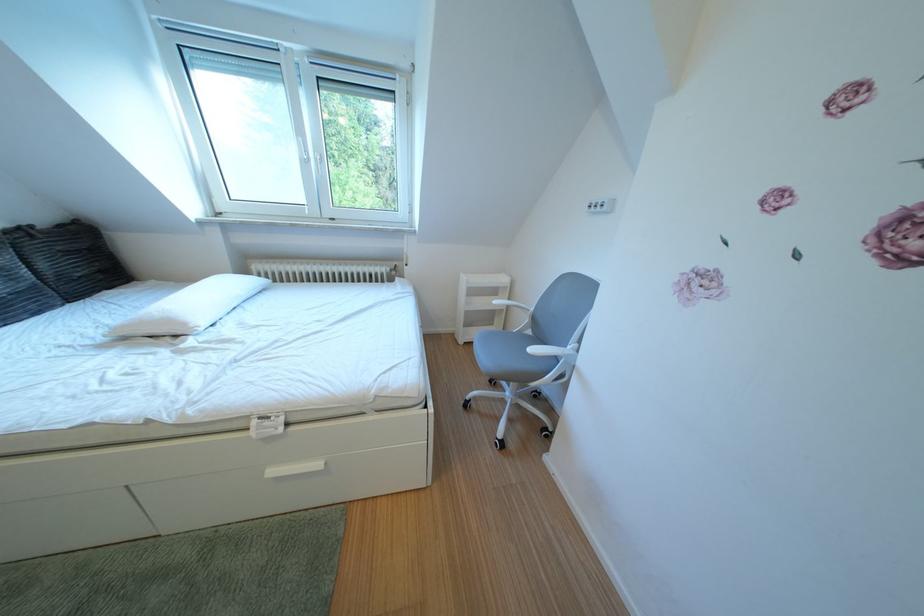
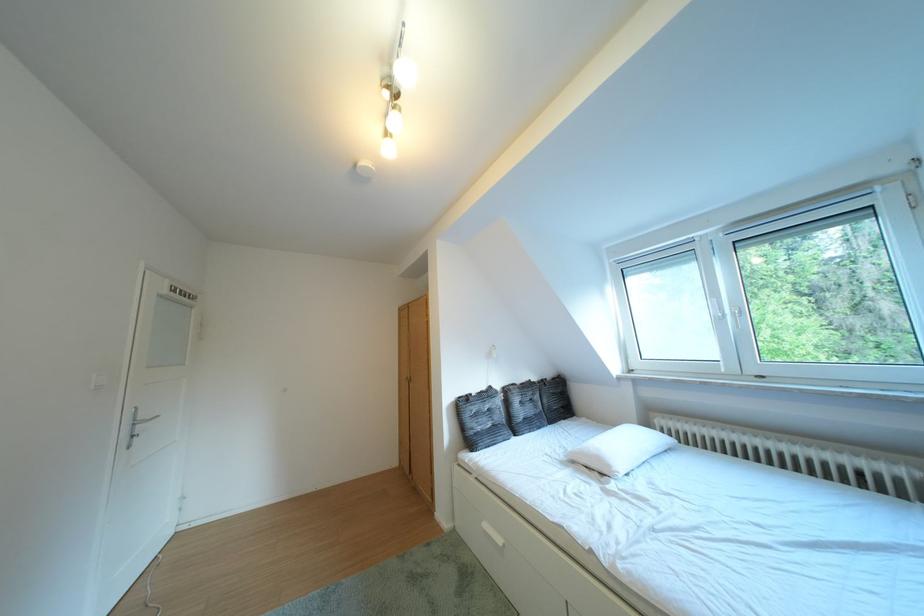
In the second image, find the point that corresponds to (199,330) in the first image.

(623, 471)